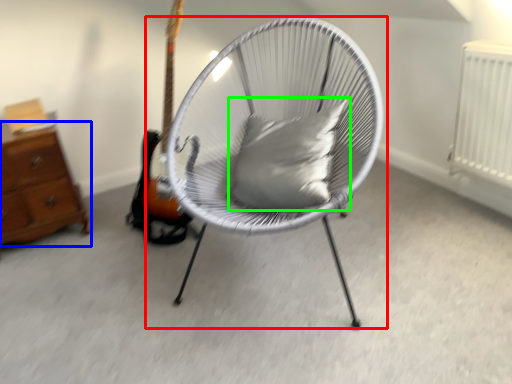
Question: Which object is the farthest from chair (highlighted by a red box)? Choose among these: chest of drawers (highlighted by a blue box) or pillow (highlighted by a green box).

Choices:
 (A) chest of drawers
 (B) pillow

Answer: (A)